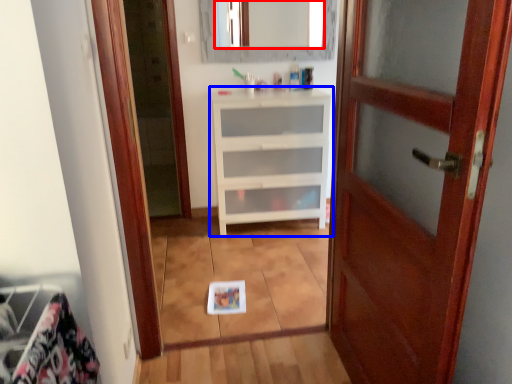
Question: Among these objects, which one is farthest to the camera, mirror (highlighted by a red box) or chest of drawers (highlighted by a blue box)?

Choices:
 (A) mirror
 (B) chest of drawers

Answer: (A)